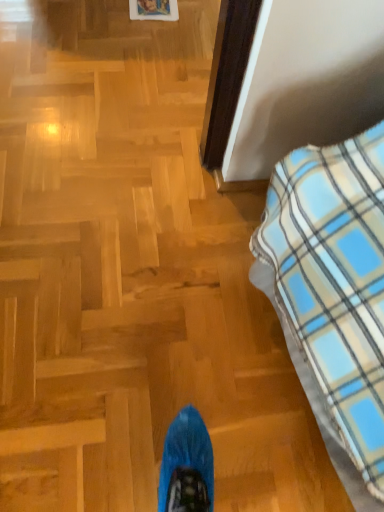
The width and height of the screenshot is (384, 512). I want to click on blue plaid blanket at right, so click(333, 295).

This screenshot has height=512, width=384. Describe the element at coordinates (333, 295) in the screenshot. I see `blue plaid blanket at right` at that location.

What do you see at coordinates (153, 10) in the screenshot? I see `wooden picture frame at upper center` at bounding box center [153, 10].

Locate an element on the screen. This screenshot has width=384, height=512. wooden picture frame at upper center is located at coordinates (153, 10).

The height and width of the screenshot is (512, 384). In order to click on blue plaid blanket at right in this screenshot , I will do `click(333, 295)`.

Which object is positioned more to the right, blue plaid blanket at right or wooden picture frame at upper center?

blue plaid blanket at right is more to the right.

Is blue plaid blanket at right in front of or behind wooden picture frame at upper center in the image?

blue plaid blanket at right is positioned closer to the viewer than wooden picture frame at upper center.

Is point (322, 244) positioned behind point (168, 2)?

No, it is not.

From the image's perspective, which one is positioned higher, blue plaid blanket at right or wooden picture frame at upper center?

From the image's view, wooden picture frame at upper center is above.

Consider the image. From a real-world perspective, is blue plaid blanket at right physically above wooden picture frame at upper center?

Indeed, from a real-world perspective, blue plaid blanket at right stands above wooden picture frame at upper center.

Between blue plaid blanket at right and wooden picture frame at upper center, which one has larger width?

blue plaid blanket at right is wider.

Between blue plaid blanket at right and wooden picture frame at upper center, which one has more height?

blue plaid blanket at right.

Looking at the image, does blue plaid blanket at right seem bigger or smaller compared to wooden picture frame at upper center?

Clearly, blue plaid blanket at right is larger in size than wooden picture frame at upper center.

Would you say blue plaid blanket at right is outside wooden picture frame at upper center?

Absolutely, blue plaid blanket at right is external to wooden picture frame at upper center.

Is blue plaid blanket at right in contact with wooden picture frame at upper center?

There is a gap between blue plaid blanket at right and wooden picture frame at upper center.

Is blue plaid blanket at right oriented towards wooden picture frame at upper center?

No.

Can you tell me how much blue plaid blanket at right and wooden picture frame at upper center differ in facing direction?

The facing directions of blue plaid blanket at right and wooden picture frame at upper center are 81.6 degrees apart.

I want to click on picture frame that appears above the blue plaid blanket at right (from the image's perspective), so click(x=153, y=10).

Can you confirm if wooden picture frame at upper center is positioned to the left of blue plaid blanket at right?

Indeed, wooden picture frame at upper center is positioned on the left side of blue plaid blanket at right.

Which object is closer to the camera taking this photo, wooden picture frame at upper center or blue plaid blanket at right?

blue plaid blanket at right.

Which is nearer, (156, 14) or (355, 458)?

Point (156, 14) is farther from the camera than point (355, 458).

From the image's perspective, between wooden picture frame at upper center and blue plaid blanket at right, who is located below?

blue plaid blanket at right, from the image's perspective.

Consider the image. From a real-world perspective, which object rests below the other?

wooden picture frame at upper center, from a real-world perspective.

Between wooden picture frame at upper center and blue plaid blanket at right, which one has smaller width?

With smaller width is wooden picture frame at upper center.

Considering the sizes of wooden picture frame at upper center and blue plaid blanket at right in the image, is wooden picture frame at upper center taller or shorter than blue plaid blanket at right?

Considering their sizes, wooden picture frame at upper center has less height than blue plaid blanket at right.

Considering the relative sizes of wooden picture frame at upper center and blue plaid blanket at right in the image provided, is wooden picture frame at upper center bigger than blue plaid blanket at right?

No.

Can we say wooden picture frame at upper center lies outside blue plaid blanket at right?

Absolutely, wooden picture frame at upper center is external to blue plaid blanket at right.

Is wooden picture frame at upper center next to blue plaid blanket at right?

No, wooden picture frame at upper center is not touching blue plaid blanket at right.

Based on the photo, is wooden picture frame at upper center positioned with its back to blue plaid blanket at right?

No, wooden picture frame at upper center is not facing away from blue plaid blanket at right.

You are a GUI agent. You are given a task and a screenshot of the screen. Output one action in this format:
    pyautogui.click(x=<x>, y=<y>)
    Task: Click on the picture frame located above the blue plaid blanket at right (from the image's perspective)
    
    Given the screenshot: What is the action you would take?
    pyautogui.click(x=153, y=10)

At what (x,y) coordinates should I click in order to perform the action: click on picture frame lying above the blue plaid blanket at right (from the image's perspective). Please return your answer as a coordinate pair (x, y). Looking at the image, I should click on (153, 10).

The image size is (384, 512). In order to click on furniture lying in front of the wooden picture frame at upper center in this screenshot , I will do `click(333, 295)`.